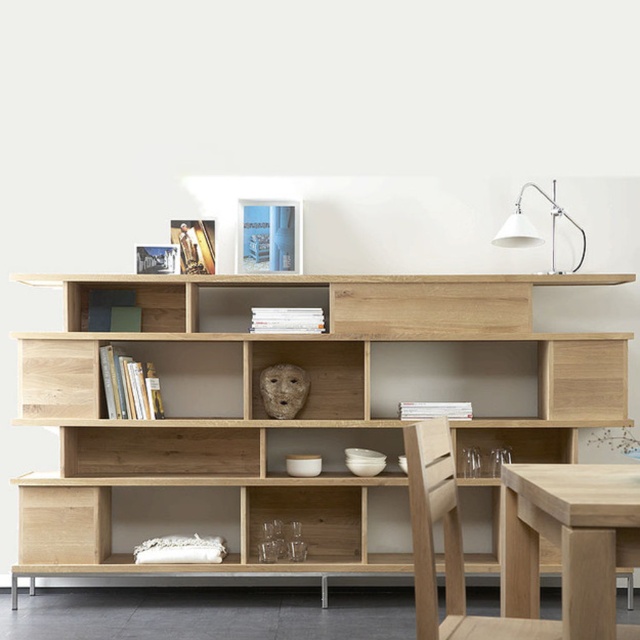
You are organizing a small art exhibition in a gallery. You have a limited space and need to decide whether to place a tall sculpture that requires a height of 1.8 meters. Given the scene, can you determine if the natural wood bookcase at center and the white matte desk lamp at upper right can accommodate this sculpture based on their heights?

The natural wood bookcase at center is much taller than the white matte desk lamp at upper right. Since the bookcase is taller, it might be suitable for placing the tall sculpture requiring 1.8 meters in height, but the exact height of the bookcase isn

You are organizing a small party and need to place a 20cm wide decorative item on the natural wood bookcase at center or the white matte desk lamp at upper right. Which location can accommodate the item based on their sizes?

The natural wood bookcase at center has a larger size compared to the white matte desk lamp at upper right, so the decorative item can be placed on the natural wood bookcase at center.